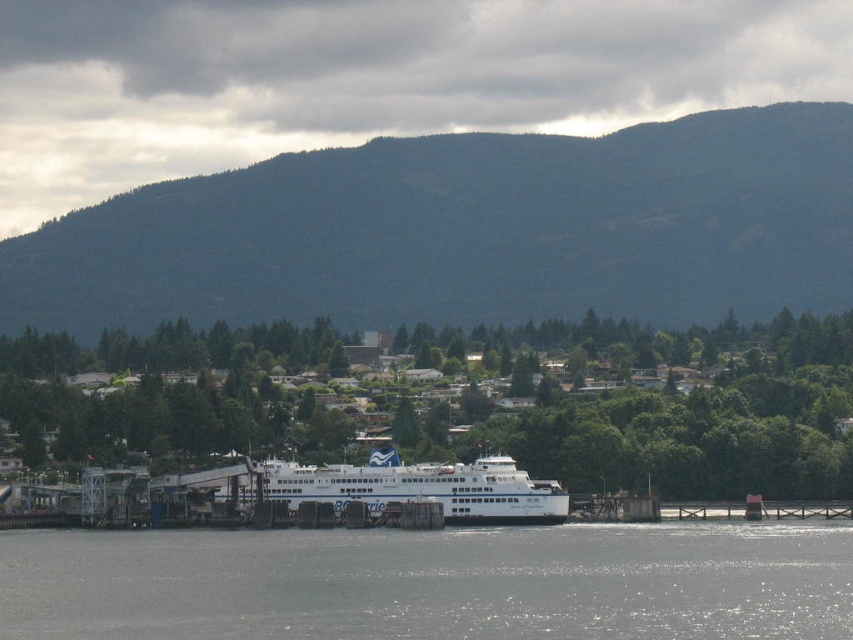
You are standing on the pier and want to estimate how far the green forested mountain at upper center is from your current position. Based on the scene, what is the approximate distance in feet?

The green forested mountain at upper center is approximately 1829.11 feet away from the viewer.

You are standing on the pier and see two points marked in the scene. Which point is closer to you, point (439,228) or point (364,493)?

Point (364,493) is closer to you because it is in front of point (439,228).

You are a photographer planning to capture the white glossy ferry at center and the green forested mountain at upper center in a single shot. Which object will occupy more of the frame in your photograph?

The green forested mountain at upper center will occupy more of the frame because it is bigger than the white glossy ferry at center.